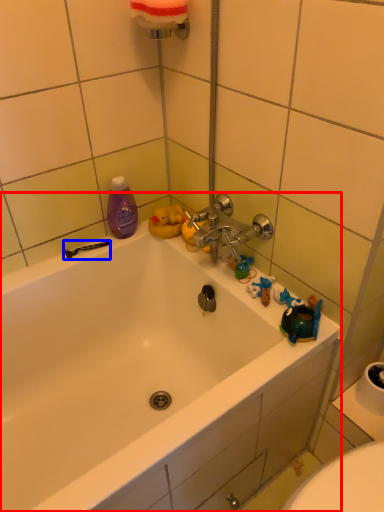
Question: Among these objects, which one is nearest to the camera, bathtub (highlighted by a red box) or shower (highlighted by a blue box)?

Choices:
 (A) bathtub
 (B) shower

Answer: (A)